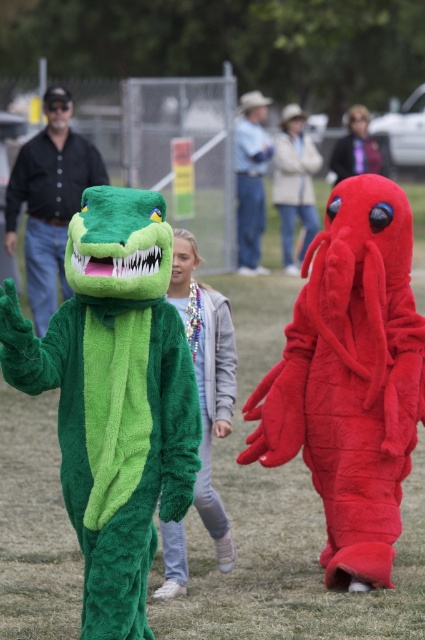
You are organizing a costume party and need to store the green plush crocodile at left and the denim jacket at center. If you have a storage space that can only hold items that take up the same amount of space, will both fit?

The green plush crocodile at left occupies less space than the denim jacket at center, so they do not take up the same amount of space. Therefore, the storage space designed for items of equal size cannot accommodate both.

You are a photographer trying to capture a photo of both the light gray fleece jacket at center and the green plush crocodile at left. Since you want them both in the frame, which direction should you move to ensure both are visible?

The light gray fleece jacket at center is to the right of the green plush crocodile at left. To include both in the frame, you should move to the left side so that both the green plush crocodile at left and the light gray fleece jacket at center are within the camera view.